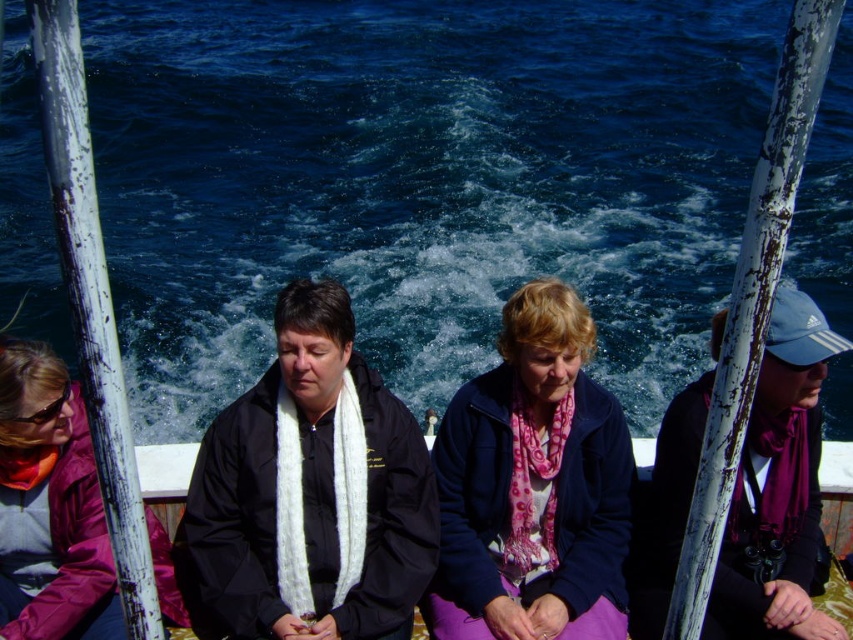
Consider the image. Between black matte jacket at center and matte pink jacket at left, which one appears on the left side from the viewer's perspective?

From the viewer's perspective, matte pink jacket at left appears more on the left side.

Image resolution: width=853 pixels, height=640 pixels. What do you see at coordinates (309, 493) in the screenshot?
I see `black matte jacket at center` at bounding box center [309, 493].

Locate an element on the screen. black matte jacket at center is located at coordinates (309, 493).

Who is lower down, blue water at center or matte pink jacket at left?

Positioned lower is matte pink jacket at left.

The image size is (853, 640). In order to click on blue water at center in this screenshot , I will do `click(419, 180)`.

Can you confirm if blue water at center is smaller than matte black jacket at center?

No, blue water at center is not smaller than matte black jacket at center.

Does blue water at center appear under matte black jacket at center?

No, blue water at center is not below matte black jacket at center.

The width and height of the screenshot is (853, 640). In order to click on blue water at center in this screenshot , I will do `click(419, 180)`.

The height and width of the screenshot is (640, 853). Identify the location of blue water at center. (419, 180).